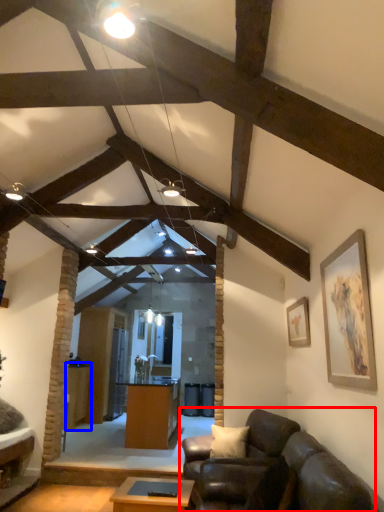
Question: Which object is further to the camera taking this photo, studio couch (highlighted by a red box) or table (highlighted by a blue box)?

Choices:
 (A) studio couch
 (B) table

Answer: (B)